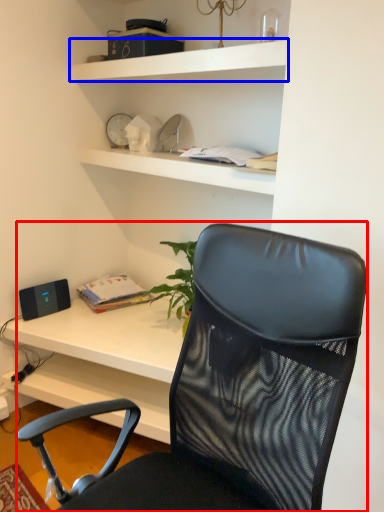
Question: Which of the following is the farthest to the observer, chair (highlighted by a red box) or shelf (highlighted by a blue box)?

Choices:
 (A) chair
 (B) shelf

Answer: (B)